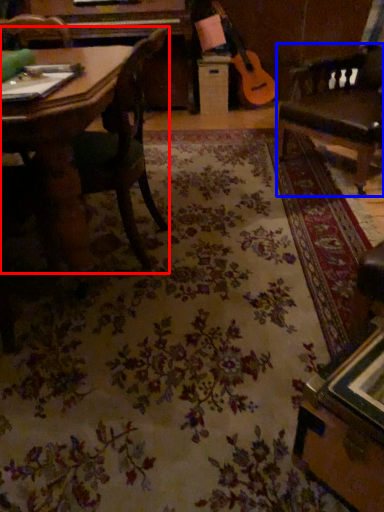
Question: Which point is further to the camera, chair (highlighted by a red box) or swivel chair (highlighted by a blue box)?

Choices:
 (A) chair
 (B) swivel chair

Answer: (B)